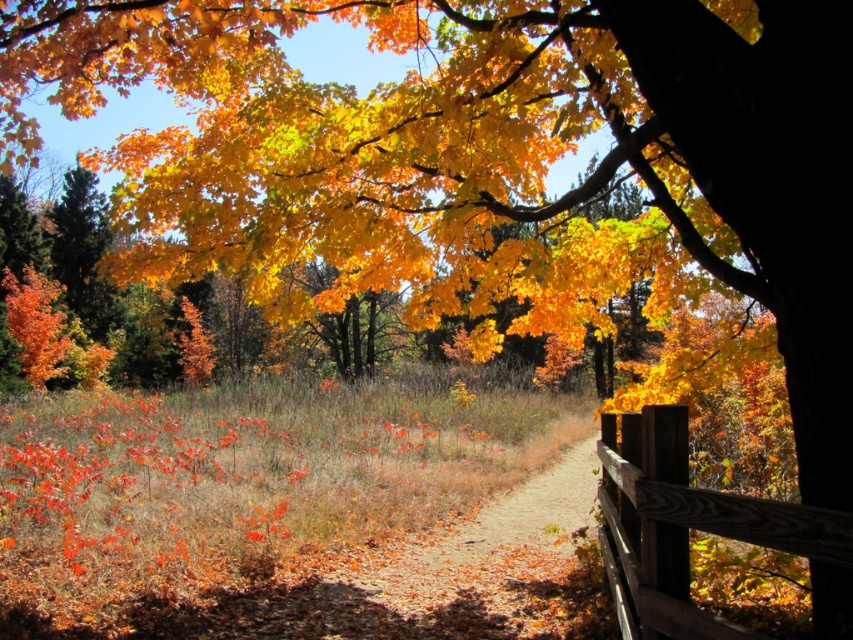
Is point (529, 516) less distant than point (622, 586)?

No, it is not.

The image size is (853, 640). What do you see at coordinates (482, 570) in the screenshot?
I see `brown dirt path at center` at bounding box center [482, 570].

Does point (303, 616) come closer to viewer compared to point (619, 625)?

No, (303, 616) is behind (619, 625).

The height and width of the screenshot is (640, 853). I want to click on brown dirt path at center, so pyautogui.click(x=482, y=570).